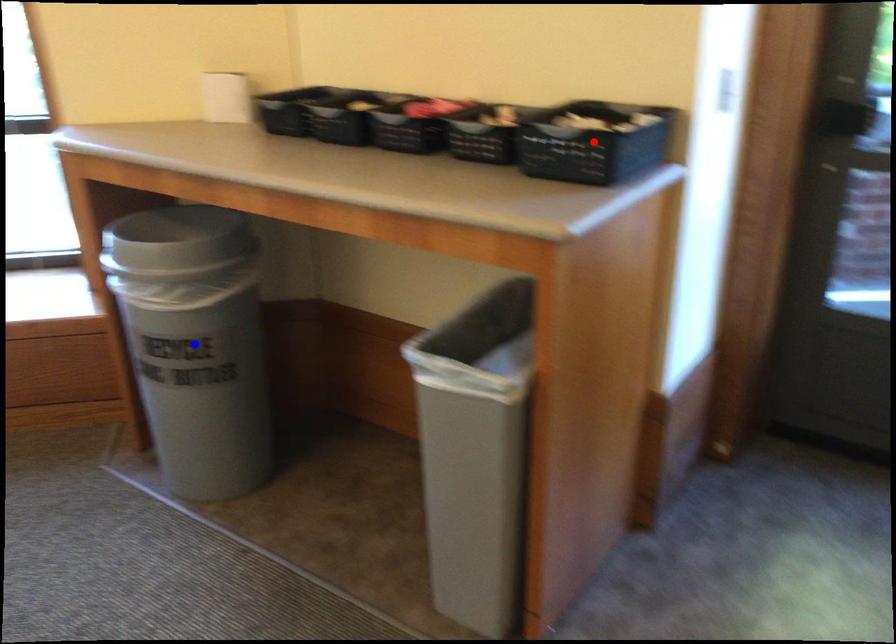
Question: Two points are marked on the image. Which point is closer to the camera?

Choices:
 (A) Blue point is closer.
 (B) Red point is closer.

Answer: (B)